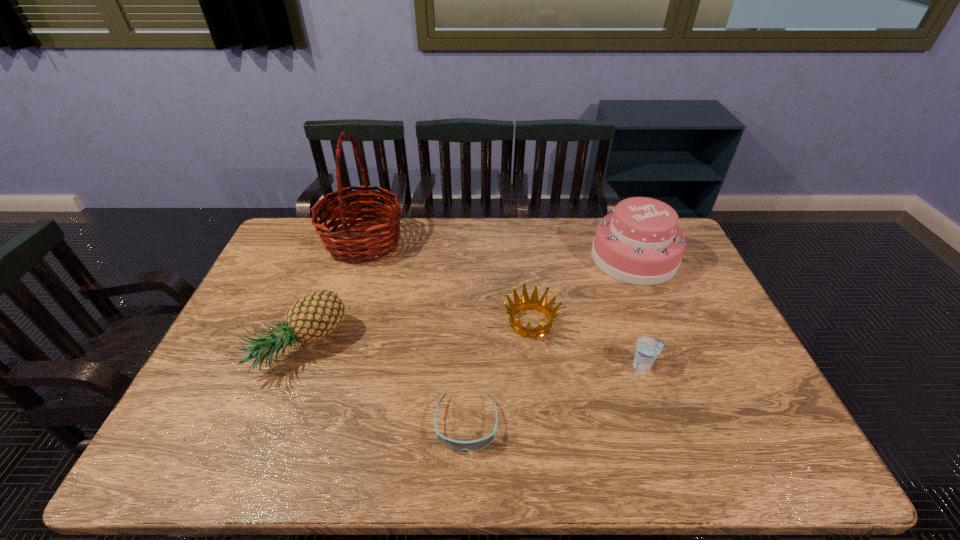
Where is `the tallest object`? This screenshot has height=540, width=960. the tallest object is located at coordinates (373, 243).

Identify the location of the second tallest object. The height and width of the screenshot is (540, 960). (639, 243).

This screenshot has width=960, height=540. Find the location of `the fourth shortest object`. the fourth shortest object is located at coordinates (314, 316).

What are the coordinates of `crown` in the screenshot? It's located at (533, 303).

At what (x,y) coordinates should I click in order to perform the action: click on yogurt. Please return your answer as a coordinate pair (x, y). This screenshot has width=960, height=540. Looking at the image, I should click on (648, 348).

Where is `the nearest object`? Image resolution: width=960 pixels, height=540 pixels. the nearest object is located at coordinates (455, 445).

Image resolution: width=960 pixels, height=540 pixels. Identify the location of the shortest object. (455, 445).

Find the location of a particular element. free space located 0.060m on the handle side of the tallest object is located at coordinates (423, 242).

Identify the location of vacant space situated 0.350m on the left of the fifth shortest object. This screenshot has width=960, height=540. (492, 258).

Identify the location of vacant space located 0.170m on the right of the fourth shortest object. tap(405, 348).